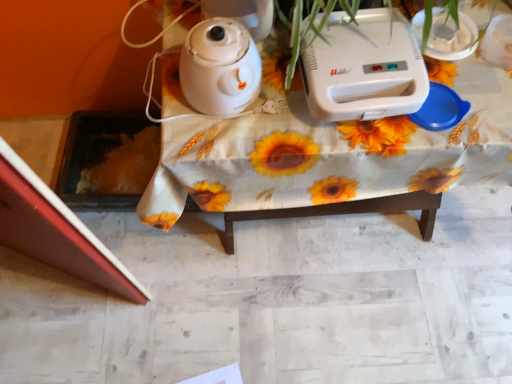
Identify the location of free area in between white plastic toaster at upper center and white glossy kettle at upper center. The image size is (512, 384). (274, 99).